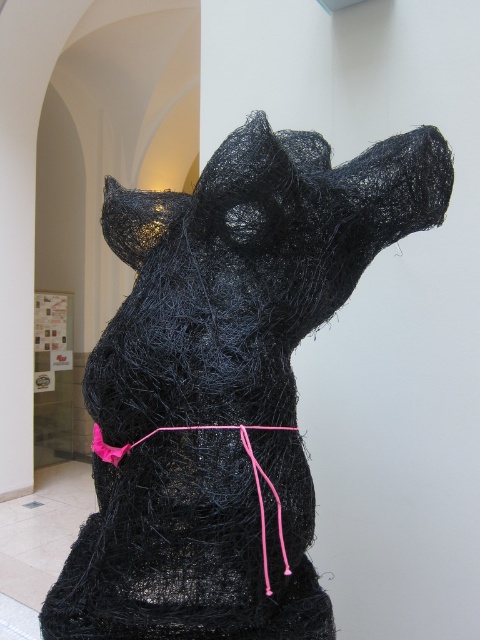
Question: Which point appears farthest from the camera in this image?

Choices:
 (A) (255, 419)
 (B) (236, 424)

Answer: (A)

Question: Considering the relative positions of black wire mesh dog at center and pink fabric string at center in the image provided, where is black wire mesh dog at center located with respect to pink fabric string at center?

Choices:
 (A) right
 (B) left

Answer: (B)

Question: Is black wire mesh dog at center further to camera compared to pink fabric string at center?

Choices:
 (A) yes
 (B) no

Answer: (B)

Question: Which point appears farthest from the camera in this image?

Choices:
 (A) (437, 180)
 (B) (187, 426)

Answer: (A)

Question: Is black wire mesh dog at center bigger than pink fabric string at center?

Choices:
 (A) yes
 (B) no

Answer: (A)